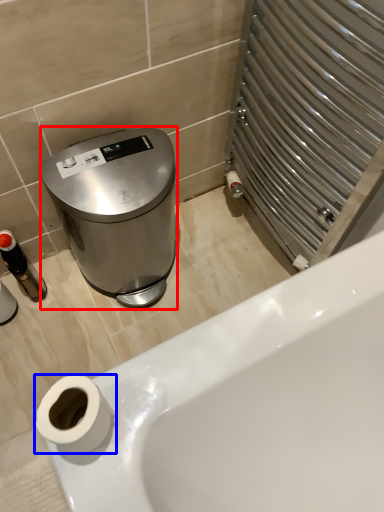
Question: Which of the following is the closest to the observer, appliance (highlighted by a red box) or toilet paper (highlighted by a blue box)?

Choices:
 (A) appliance
 (B) toilet paper

Answer: (B)